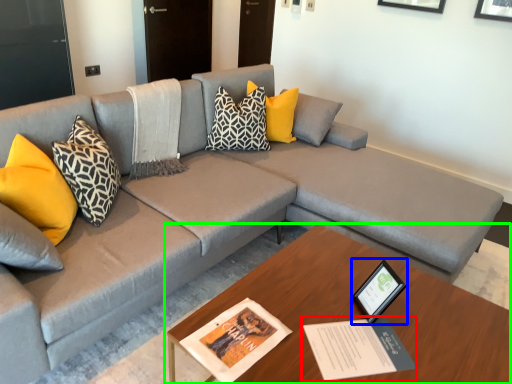
Question: Considering the real-world distances, which object is farthest from book (highlighted by a red box)? picture frame (highlighted by a blue box) or table (highlighted by a green box)?

Choices:
 (A) picture frame
 (B) table

Answer: (B)